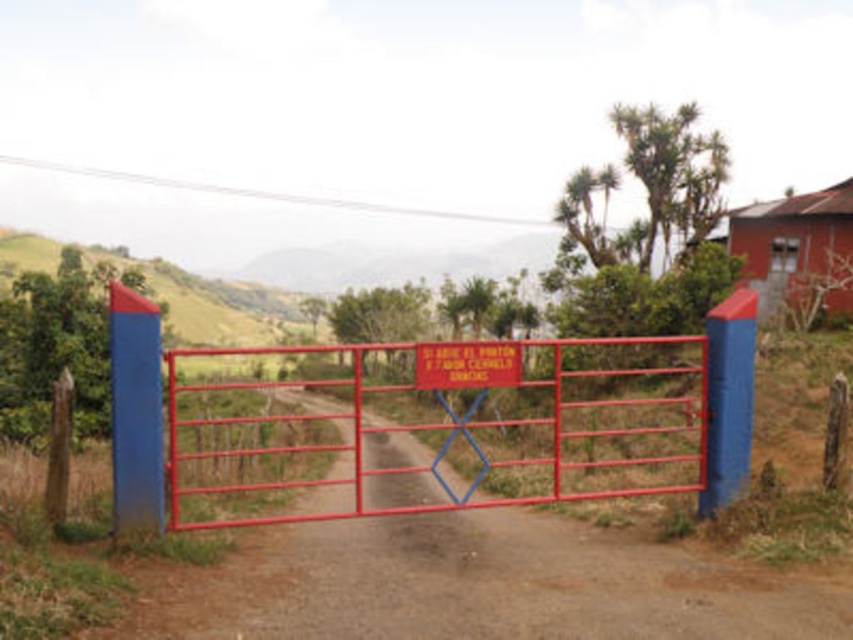
You are a hiker approaching the metal gate at center and the red plastic sign at center. Which object will you encounter first as you walk towards them?

The metal gate at center will be encountered first because it is positioned below the red plastic sign at center, meaning it is closer to the observer.

You are standing at the point marked by the red metal gate with blue accents. You want to reach a treasure chest located at the point labeled point (x=358, y=561). The treasure chest is 11.55 meters away from you. If you can walk 3 meters per minute, how many minutes will it take you to reach the treasure chest?

The distance between you and the treasure chest at point (x=358, y=561) is 11.55 meters. Since you can walk 3 meters per minute, it will take you 11.55 divided by 3, which is approximately 3.85 minutes to reach the treasure chest.

You are a delivery person approaching the metal gate at center and the red plastic sign at center. Which object will you encounter first as you move toward them?

The metal gate at center is in front of the red plastic sign at center, so you will encounter the metal gate at center first.